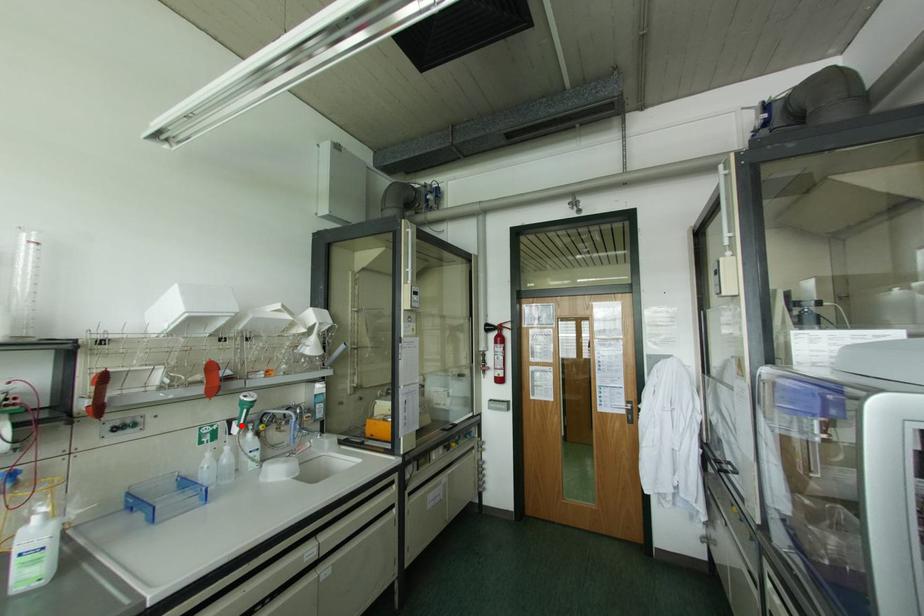
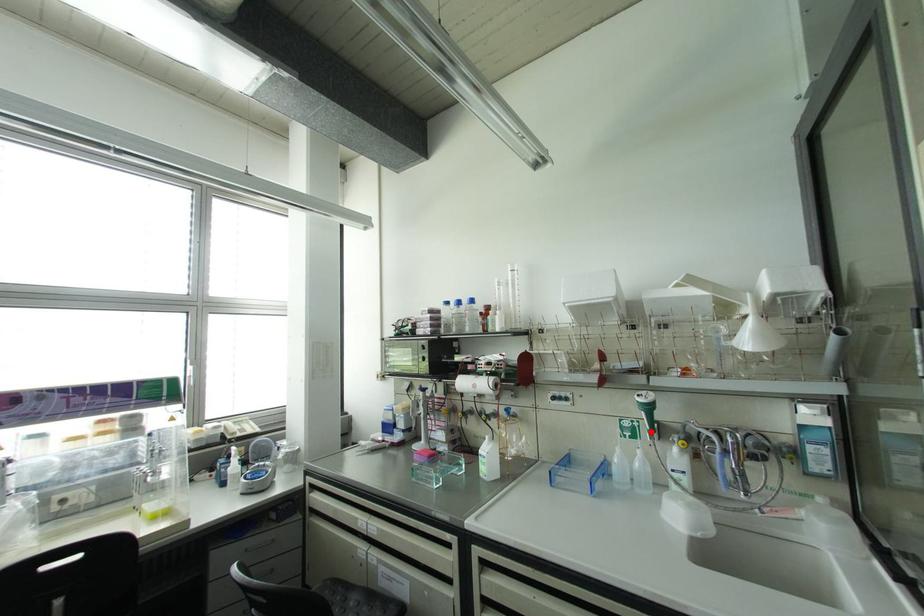
I am providing you with two images of the same scene from different viewpoints. A red point is marked on the first image and another point is marked on the second image. Are the points marked in image1 and image2 representing the same 3D position?

Yes